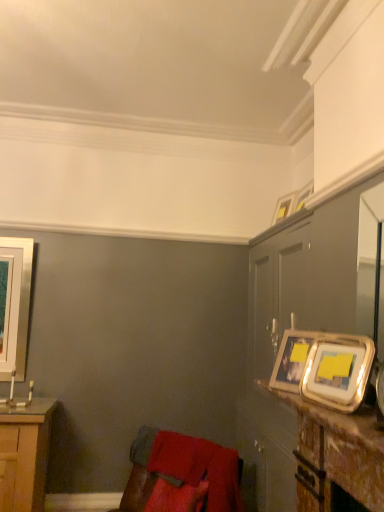
Question: Is velvet red swivel chair at lower left positioned before metallic silver picture frame at upper right, the third picture frame positioned from the back?

Choices:
 (A) yes
 (B) no

Answer: (B)

Question: Is metallic silver picture frame at upper right, arranged as the 2th picture frame when viewed from the left, at the back of velvet red swivel chair at lower left?

Choices:
 (A) yes
 (B) no

Answer: (B)

Question: From a real-world perspective, is velvet red swivel chair at lower left positioned over metallic silver picture frame at upper right, the second picture frame in the front-to-back sequence, based on gravity?

Choices:
 (A) no
 (B) yes

Answer: (A)

Question: Can you confirm if velvet red swivel chair at lower left is shorter than metallic silver picture frame at upper right, the third picture frame positioned from the back?

Choices:
 (A) yes
 (B) no

Answer: (B)

Question: Is velvet red swivel chair at lower left facing towards metallic silver picture frame at upper right, the third picture frame positioned from the back?

Choices:
 (A) no
 (B) yes

Answer: (A)

Question: From the image's perspective, relative to velvet red swivel chair at lower left, is metallic gold picture frame at upper right, which is the 1th picture frame from right to left, above or below?

Choices:
 (A) below
 (B) above

Answer: (B)

Question: Looking at the image, does metallic gold picture frame at upper right, the second picture frame in the back-to-front sequence, seem bigger or smaller compared to velvet red swivel chair at lower left?

Choices:
 (A) small
 (B) big

Answer: (A)

Question: From a real-world perspective, is metallic gold picture frame at upper right, the second picture frame in the back-to-front sequence, physically located above or below velvet red swivel chair at lower left?

Choices:
 (A) above
 (B) below

Answer: (A)

Question: Is metallic gold picture frame at upper right, which is the 1th picture frame from right to left, inside the boundaries of velvet red swivel chair at lower left, or outside?

Choices:
 (A) outside
 (B) inside

Answer: (A)

Question: Is silver metallic picture frame at left, the 4th picture frame from the front, spatially inside metallic gold frame at upper right, or outside of it?

Choices:
 (A) outside
 (B) inside

Answer: (A)

Question: Is silver metallic picture frame at left, which ranks as the first picture frame in left-to-right order, in front of or behind metallic gold frame at upper right in the image?

Choices:
 (A) front
 (B) behind

Answer: (B)

Question: Is silver metallic picture frame at left, positioned as the fourth picture frame in right-to-left order, to the left or to the right of metallic gold frame at upper right in the image?

Choices:
 (A) right
 (B) left

Answer: (B)

Question: Is point (26, 350) closer or farther from the camera than point (375, 176)?

Choices:
 (A) farther
 (B) closer

Answer: (A)

Question: In terms of height, does wooden table at right look taller or shorter compared to silver metallic picture frame at right, placed as the third picture frame when sorted from left to right?

Choices:
 (A) short
 (B) tall

Answer: (A)

Question: Considering the positions of wooden table at right and silver metallic picture frame at right, which appears as the second picture frame when viewed from the right, in the image, is wooden table at right bigger or smaller than silver metallic picture frame at right, which appears as the second picture frame when viewed from the right,?

Choices:
 (A) small
 (B) big

Answer: (B)